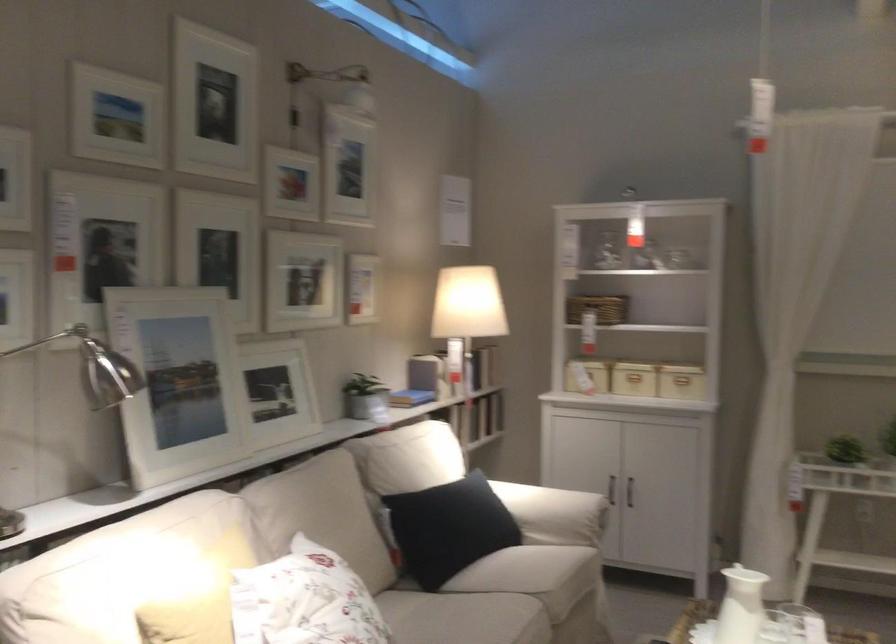
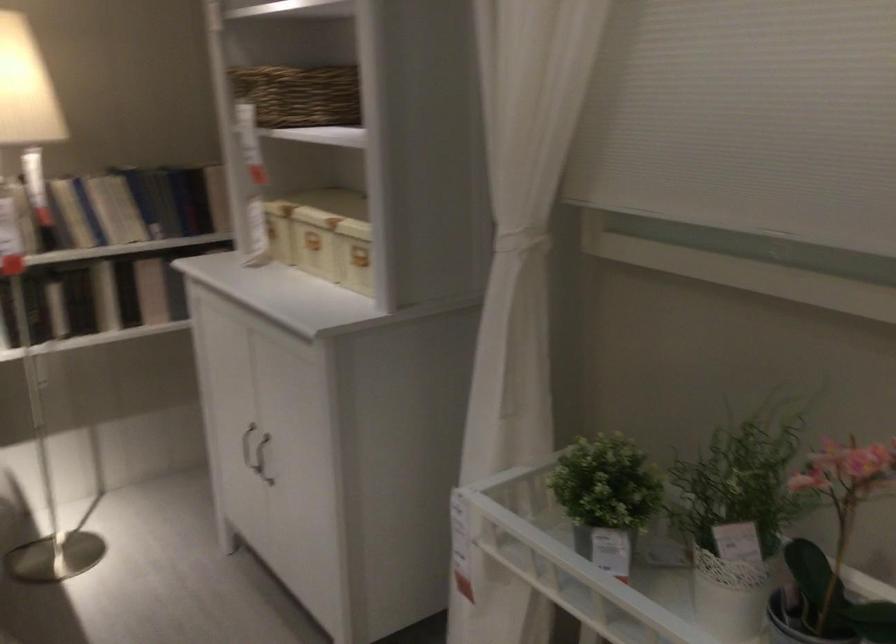
The point at (650, 365) is marked in the first image. Where is the corresponding point in the second image?

(314, 242)